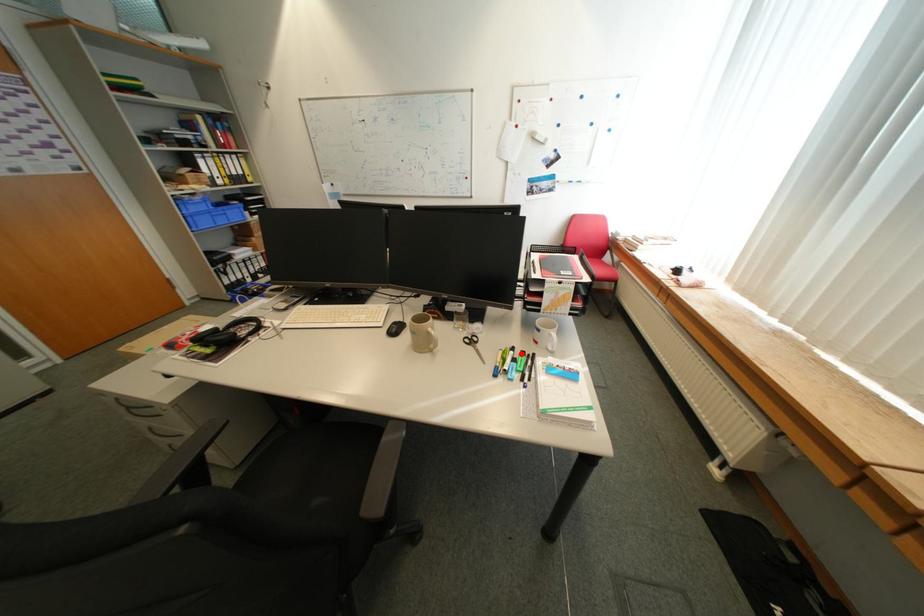
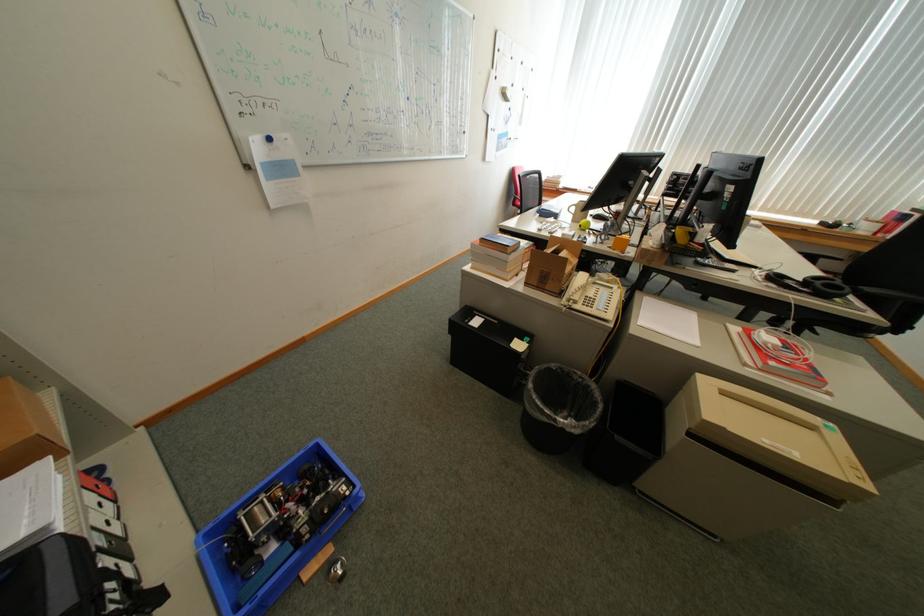
Question: I am providing you with two images of the same scene from different viewpoints. A red point is marked on the first image. Can you still see the location of the red point in image 2?

Choices:
 (A) Yes
 (B) No

Answer: (B)